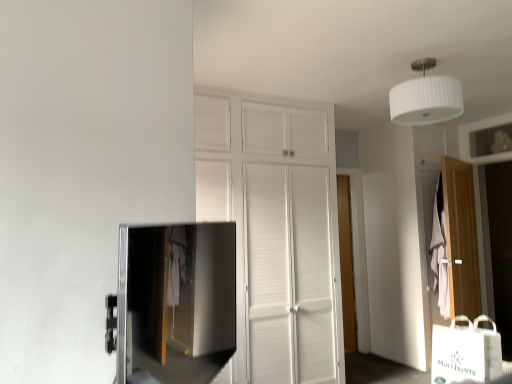
Locate an element on the screen. The height and width of the screenshot is (384, 512). pink fabric at right is located at coordinates (439, 253).

Measure the distance between point (404, 82) and camera.

The depth of point (404, 82) is 9.16 feet.

Identify the location of wooden door at center, which is counted as the first door, starting from the back. The height and width of the screenshot is (384, 512). (346, 263).

This screenshot has height=384, width=512. Describe the element at coordinates (346, 263) in the screenshot. I see `wooden door at center, the 2th door viewed from the right` at that location.

The width and height of the screenshot is (512, 384). What are the coordinates of `satin black tv at lower left` in the screenshot? It's located at (176, 301).

Is point (341, 185) positioned in front of point (453, 176)?

No.

Does wooden door at center, which is counted as the first door, starting from the back, turn towards wooden door at right, which appears as the 1th door when viewed from the front?

No.

At what (x,y) coordinates should I click in order to perform the action: click on door located above the wooden door at center, which is counted as the first door, starting from the back (from the image's perspective). Please return your answer as a coordinate pair (x, y). The image size is (512, 384). Looking at the image, I should click on [x=461, y=238].

Considering their positions, is wooden door at center, the 2th door viewed from the right, located in front of or behind wooden door at right, positioned as the first door in right-to-left order?

wooden door at center, the 2th door viewed from the right, is positioned farther from the viewer than wooden door at right, positioned as the first door in right-to-left order.

Which of these two, pink fabric at right or satin black tv at lower left, is wider?

Wider between the two is pink fabric at right.

You are a GUI agent. You are given a task and a screenshot of the screen. Output one action in this format:
    pyautogui.click(x=<x>, y=<y>)
    Task: Click on the blanket above the satin black tv at lower left (from a real-world perspective)
    The height and width of the screenshot is (384, 512).
    Given the screenshot: What is the action you would take?
    pyautogui.click(x=439, y=253)

Would you say pink fabric at right is outside satin black tv at lower left?

That's correct, pink fabric at right is outside of satin black tv at lower left.

In terms of height, does pink fabric at right look taller or shorter compared to satin black tv at lower left?

Clearly, pink fabric at right is taller compared to satin black tv at lower left.

Which of these two, pink fabric at right or wooden door at right, the 2th door when ordered from back to front, stands taller?

Standing taller between the two is wooden door at right, the 2th door when ordered from back to front.

Does point (441, 300) come farther from viewer compared to point (455, 209)?

No.

Looking at this image, based on their positions, is pink fabric at right located to the left or right of wooden door at right, the 2th door from the left?

pink fabric at right is positioned on wooden door at right, the 2th door from the left,'s left side.

Based on the photo, from the image's perspective, which object appears higher, pink fabric at right or wooden door at right, which appears as the 1th door when viewed from the front?

pink fabric at right appears higher in the image.

Relative to white paper bag at lower right, is satin black tv at lower left in front or behind?

In the image, satin black tv at lower left appears in front of white paper bag at lower right.

From a real-world perspective, who is located higher, satin black tv at lower left or white paper bag at lower right?

satin black tv at lower left, from a real-world perspective.

Does satin black tv at lower left have a lesser height compared to white paper bag at lower right?

In fact, satin black tv at lower left may be taller than white paper bag at lower right.

What's the angular difference between white ribbed shade at upper center and wooden door at right, the 2th door when ordered from back to front,'s facing directions?

The angular difference between white ribbed shade at upper center and wooden door at right, the 2th door when ordered from back to front, is 68 degrees.

Is white ribbed shade at upper center with wooden door at right, positioned as the first door in right-to-left order?

white ribbed shade at upper center and wooden door at right, positioned as the first door in right-to-left order, are clearly separated.

How distant is white ribbed shade at upper center from wooden door at right, the 2th door when ordered from back to front?

The distance of white ribbed shade at upper center from wooden door at right, the 2th door when ordered from back to front, is 4.95 feet.

Considering the positions of point (451, 94) and point (461, 184), is point (451, 94) closer or farther from the camera than point (461, 184)?

Point (451, 94) appears to be closer to the viewer than point (461, 184).

Looking at this image, looking at their sizes, would you say wooden door at right, the 2th door when ordered from back to front, is wider or thinner than white paper bag at lower right?

Considering their sizes, wooden door at right, the 2th door when ordered from back to front, looks slimmer than white paper bag at lower right.

Between wooden door at right, the 2th door when ordered from back to front, and white paper bag at lower right, which one has less height?

white paper bag at lower right.

From the image's perspective, is wooden door at right, the 2th door when ordered from back to front, on top of white paper bag at lower right?

Yes.

Can you confirm if wooden door at right, the 2th door when ordered from back to front, is bigger than white paper bag at lower right?

Yes.

Which object is closer to the camera taking this photo, wooden door at right, the 2th door from the left, or pink fabric at right?

wooden door at right, the 2th door from the left, is more forward.

How many degrees apart are the facing directions of wooden door at right, which appears as the 1th door when viewed from the front, and pink fabric at right?

The facing directions of wooden door at right, which appears as the 1th door when viewed from the front, and pink fabric at right are 90 degrees apart.

From their relative heights in the image, would you say wooden door at right, positioned as the first door in right-to-left order, is taller or shorter than pink fabric at right?

wooden door at right, positioned as the first door in right-to-left order, is taller than pink fabric at right.

Is wooden door at right, the 2th door from the left, facing away from pink fabric at right?

Yes, wooden door at right, the 2th door from the left, is facing away from pink fabric at right.

This screenshot has width=512, height=384. I want to click on door above the wooden door at center, which is counted as the 1th door, starting from the left (from the image's perspective), so click(x=461, y=238).

Identify the location of blanket behind the satin black tv at lower left. (439, 253).

Which object lies further to the anchor point satin black tv at lower left, white ribbed shade at upper center or white paper bag at lower right?

white ribbed shade at upper center.

When comparing their distances from white ribbed shade at upper center, does pink fabric at right or satin black tv at lower left seem closer?

pink fabric at right.

When comparing their distances from wooden door at center, which is counted as the 1th door, starting from the left, does white paper bag at lower right or satin black tv at lower left seem closer?

The object closer to wooden door at center, which is counted as the 1th door, starting from the left, is satin black tv at lower left.

From the image, which object appears to be nearer to pink fabric at right, white ribbed shade at upper center or wooden door at center, which is counted as the first door, starting from the back?

wooden door at center, which is counted as the first door, starting from the back, is positioned closer to the anchor pink fabric at right.

Which object lies further to the anchor point satin black tv at lower left, white paper bag at lower right or wooden door at center, which is counted as the 1th door, starting from the left?

Based on the image, white paper bag at lower right appears to be further to satin black tv at lower left.

Estimate the real-world distances between objects in this image. Which object is closer to wooden door at center, the second door when ordered from front to back, white ribbed shade at upper center or satin black tv at lower left?

satin black tv at lower left is positioned closer to the anchor wooden door at center, the second door when ordered from front to back.

Considering their positions, is pink fabric at right positioned further to wooden door at right, the 2th door when ordered from back to front, than satin black tv at lower left?

The object further to wooden door at right, the 2th door when ordered from back to front, is satin black tv at lower left.

From the image, which object appears to be farther from wooden door at right, which appears as the 1th door when viewed from the front, white ribbed shade at upper center or satin black tv at lower left?

Based on the image, satin black tv at lower left appears to be further to wooden door at right, which appears as the 1th door when viewed from the front.

This screenshot has width=512, height=384. What are the coordinates of `lamp between satin black tv at lower left and wooden door at center, the 2th door viewed from the right, along the z-axis` in the screenshot? It's located at (426, 97).

Find the location of `shopping bag between satin black tv at lower left and wooden door at right, the 2th door from the left, from front to back`. shopping bag between satin black tv at lower left and wooden door at right, the 2th door from the left, from front to back is located at coordinates (465, 352).

Where is `blanket between white ribbed shade at upper center and wooden door at right, positioned as the first door in right-to-left order, in the up-down direction`? blanket between white ribbed shade at upper center and wooden door at right, positioned as the first door in right-to-left order, in the up-down direction is located at coordinates (439, 253).

Where is `door positioned between white ribbed shade at upper center and wooden door at center, which is counted as the first door, starting from the back, from near to far`? door positioned between white ribbed shade at upper center and wooden door at center, which is counted as the first door, starting from the back, from near to far is located at coordinates (461, 238).